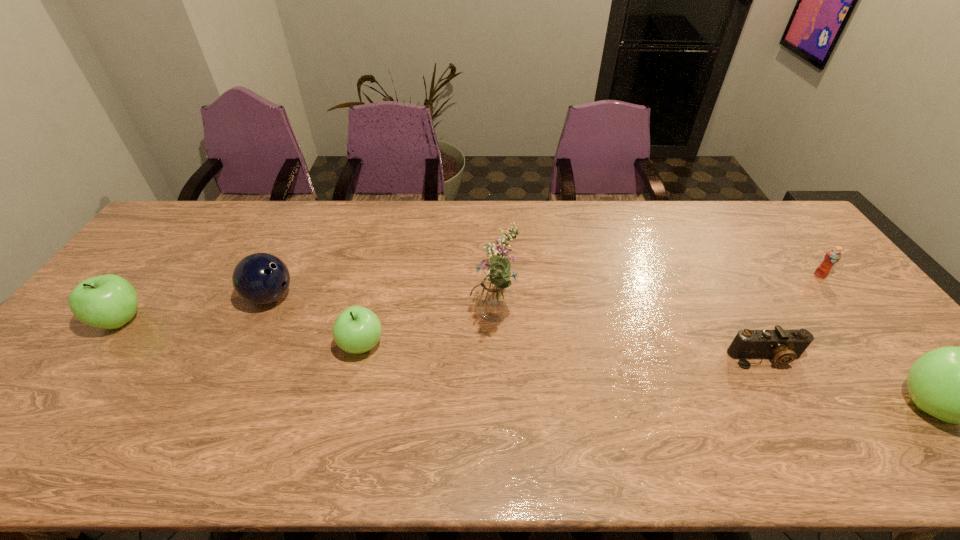
To ensure equal spacing by inserting another apple among them, please point out a vacant spot for this new apple. Please provide its 2D coordinates. Your answer should be formatted as a tuple, i.e. [(x, y)], where the tuple contains the x and y coordinates of a point satisfying the conditions above.

[(631, 374)]